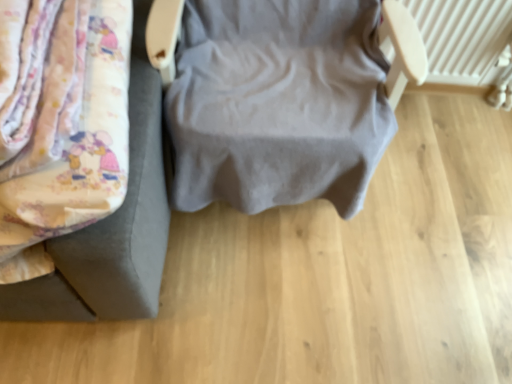
What is the approximate height of gray fabric chair at center, which is the 1th furniture in right-to-left order?

gray fabric chair at center, which is the 1th furniture in right-to-left order, is 28.98 inches in height.

What do you see at coordinates (281, 97) in the screenshot? I see `gray fabric chair at center, which is counted as the second furniture, starting from the left` at bounding box center [281, 97].

Measure the distance between point (111, 295) and camera.

The depth of point (111, 295) is 36.65 inches.

Image resolution: width=512 pixels, height=384 pixels. I want to click on gray fabric chair at center, which is counted as the second furniture, starting from the left, so click(x=281, y=97).

Between white textured radiator at upper right and fluffy fabric bed at left, which is the first furniture in left-to-right order, which one has larger size?

Bigger between the two is fluffy fabric bed at left, which is the first furniture in left-to-right order.

Based on the photo, is fluffy fabric bed at left, acting as the 2th furniture starting from the right, surrounded by white textured radiator at upper right?

No, fluffy fabric bed at left, acting as the 2th furniture starting from the right, is not a part of white textured radiator at upper right.

Is white textured radiator at upper right taller or shorter than fluffy fabric bed at left, acting as the 2th furniture starting from the right?

Considering their sizes, white textured radiator at upper right has more height than fluffy fabric bed at left, acting as the 2th furniture starting from the right.

Is gray fabric chair at center, which is the 1th furniture in right-to-left order, positioned far away from fluffy fabric bed at left, which is the first furniture in left-to-right order?

No, gray fabric chair at center, which is the 1th furniture in right-to-left order, is in close proximity to fluffy fabric bed at left, which is the first furniture in left-to-right order.

Which is behind, gray fabric chair at center, which is counted as the second furniture, starting from the left, or fluffy fabric bed at left, which is the first furniture in left-to-right order?

gray fabric chair at center, which is counted as the second furniture, starting from the left, is behind.

Considering the positions of objects gray fabric chair at center, which is the 1th furniture in right-to-left order, and fluffy fabric bed at left, which is the first furniture in left-to-right order, in the image provided, who is more to the left, gray fabric chair at center, which is the 1th furniture in right-to-left order, or fluffy fabric bed at left, which is the first furniture in left-to-right order,?

Positioned to the left is fluffy fabric bed at left, which is the first furniture in left-to-right order.

From the picture: Between gray fabric chair at center, which is the 1th furniture in right-to-left order, and fluffy fabric bed at left, acting as the 2th furniture starting from the right, which one has larger size?

gray fabric chair at center, which is the 1th furniture in right-to-left order, is bigger.

Does point (296, 158) come closer to viewer compared to point (485, 8)?

Yes, it is.

From the image's perspective, is gray fabric chair at center, which is counted as the second furniture, starting from the left, on white textured radiator at upper right?

Incorrect, from the image's perspective, gray fabric chair at center, which is counted as the second furniture, starting from the left, is lower than white textured radiator at upper right.

Which of these two, gray fabric chair at center, which is the 1th furniture in right-to-left order, or white textured radiator at upper right, stands taller?

gray fabric chair at center, which is the 1th furniture in right-to-left order.

In the image, there is a gray fabric chair at center, which is the 1th furniture in right-to-left order. Identify the location of radiator below it (from a real-world perspective). (463, 38).

Is fluffy fabric bed at left, acting as the 2th furniture starting from the right, turned away from gray fabric chair at center, which is the 1th furniture in right-to-left order?

fluffy fabric bed at left, acting as the 2th furniture starting from the right, does not have its back to gray fabric chair at center, which is the 1th furniture in right-to-left order.

Considering the sizes of objects fluffy fabric bed at left, acting as the 2th furniture starting from the right, and gray fabric chair at center, which is the 1th furniture in right-to-left order, in the image provided, who is taller, fluffy fabric bed at left, acting as the 2th furniture starting from the right, or gray fabric chair at center, which is the 1th furniture in right-to-left order,?

With more height is gray fabric chair at center, which is the 1th furniture in right-to-left order.

Where is `furniture behind the fluffy fabric bed at left, which is the first furniture in left-to-right order`? Image resolution: width=512 pixels, height=384 pixels. furniture behind the fluffy fabric bed at left, which is the first furniture in left-to-right order is located at coordinates (281, 97).

Based on the photo, would you say fluffy fabric bed at left, which is the first furniture in left-to-right order, is a long distance from gray fabric chair at center, which is counted as the second furniture, starting from the left?

They are positioned close to each other.

Can you tell me how much fluffy fabric bed at left, which is the first furniture in left-to-right order, and white textured radiator at upper right differ in facing direction?

fluffy fabric bed at left, which is the first furniture in left-to-right order, and white textured radiator at upper right are facing 0.141 degrees away from each other.

From the picture: Considering the relative positions of fluffy fabric bed at left, acting as the 2th furniture starting from the right, and white textured radiator at upper right in the image provided, is fluffy fabric bed at left, acting as the 2th furniture starting from the right, to the right of white textured radiator at upper right from the viewer's perspective?

No, fluffy fabric bed at left, acting as the 2th furniture starting from the right, is not to the right of white textured radiator at upper right.

Is the depth of fluffy fabric bed at left, which is the first furniture in left-to-right order, less than that of white textured radiator at upper right?

Yes, fluffy fabric bed at left, which is the first furniture in left-to-right order, is closer to the viewer.

Is fluffy fabric bed at left, acting as the 2th furniture starting from the right, inside or outside of white textured radiator at upper right?

fluffy fabric bed at left, acting as the 2th furniture starting from the right, is spatially situated outside white textured radiator at upper right.

Can you tell me how much white textured radiator at upper right and gray fabric chair at center, which is counted as the second furniture, starting from the left, differ in facing direction?

90.6 degrees.

Between white textured radiator at upper right and gray fabric chair at center, which is the 1th furniture in right-to-left order, which one has larger width?

gray fabric chair at center, which is the 1th furniture in right-to-left order, is wider.

Is white textured radiator at upper right aimed at gray fabric chair at center, which is counted as the second furniture, starting from the left?

No, white textured radiator at upper right is not turned towards gray fabric chair at center, which is counted as the second furniture, starting from the left.

From the image's perspective, which one is positioned lower, white textured radiator at upper right or gray fabric chair at center, which is the 1th furniture in right-to-left order?

gray fabric chair at center, which is the 1th furniture in right-to-left order, from the image's perspective.

Locate an element on the screen. radiator on the right of fluffy fabric bed at left, which is the first furniture in left-to-right order is located at coordinates (463, 38).

Locate an element on the screen. The width and height of the screenshot is (512, 384). furniture located behind the fluffy fabric bed at left, which is the first furniture in left-to-right order is located at coordinates (281, 97).

Consider the image. From the image, which object appears to be nearer to white textured radiator at upper right, gray fabric chair at center, which is the 1th furniture in right-to-left order, or fluffy fabric bed at left, which is the first furniture in left-to-right order?

gray fabric chair at center, which is the 1th furniture in right-to-left order, is closer to white textured radiator at upper right.

Consider the image. Which object lies nearer to the anchor point fluffy fabric bed at left, which is the first furniture in left-to-right order, white textured radiator at upper right or gray fabric chair at center, which is the 1th furniture in right-to-left order?

Among the two, gray fabric chair at center, which is the 1th furniture in right-to-left order, is located nearer to fluffy fabric bed at left, which is the first furniture in left-to-right order.

When comparing their distances from gray fabric chair at center, which is the 1th furniture in right-to-left order, does fluffy fabric bed at left, which is the first furniture in left-to-right order, or white textured radiator at upper right seem closer?

Based on the image, fluffy fabric bed at left, which is the first furniture in left-to-right order, appears to be nearer to gray fabric chair at center, which is the 1th furniture in right-to-left order.

Based on their spatial positions, is white textured radiator at upper right or fluffy fabric bed at left, which is the first furniture in left-to-right order, closer to gray fabric chair at center, which is counted as the second furniture, starting from the left?

fluffy fabric bed at left, which is the first furniture in left-to-right order, is positioned closer to the anchor gray fabric chair at center, which is counted as the second furniture, starting from the left.

Based on their spatial positions, is fluffy fabric bed at left, acting as the 2th furniture starting from the right, or gray fabric chair at center, which is counted as the second furniture, starting from the left, further from white textured radiator at upper right?

fluffy fabric bed at left, acting as the 2th furniture starting from the right, is positioned further to the anchor white textured radiator at upper right.

Estimate the real-world distances between objects in this image. Which object is further from fluffy fabric bed at left, which is the first furniture in left-to-right order, gray fabric chair at center, which is counted as the second furniture, starting from the left, or white textured radiator at upper right?

white textured radiator at upper right is further to fluffy fabric bed at left, which is the first furniture in left-to-right order.

Find the location of a particular element. The height and width of the screenshot is (384, 512). furniture between fluffy fabric bed at left, acting as the 2th furniture starting from the right, and white textured radiator at upper right, in the horizontal direction is located at coordinates (281, 97).